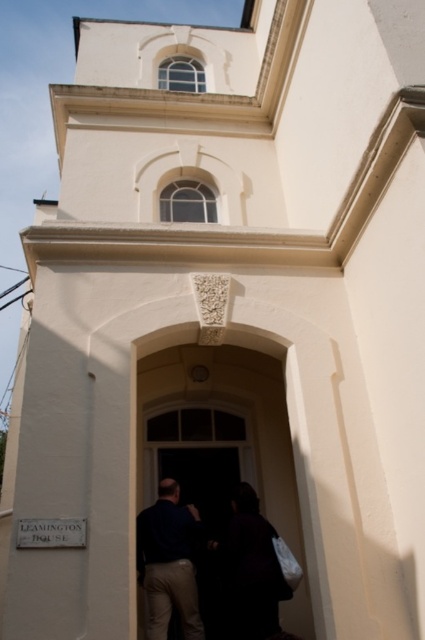
You are standing at the entrance of Leamington House and see a point marked at coordinates [252,568]. According to the image, what object is this point located on?

The point at coordinates [252,568] is located on the dark fabric couple at center.

You are standing at the entrance of Leamington House and want to open the door. The door handle is located at point [221,442]. Is the door handle on the dark brown wooden door at center?

Yes, the point [221,442] is on the dark brown wooden door at center, so the door handle is located there.

You are standing at the entrance of Leamington House and see the dark brown wooden door at center and the dark blue shirt at center. Which object is closer to you?

The dark brown wooden door at center is positioned over the dark blue shirt at center, so the dark brown wooden door at center is closer to you.